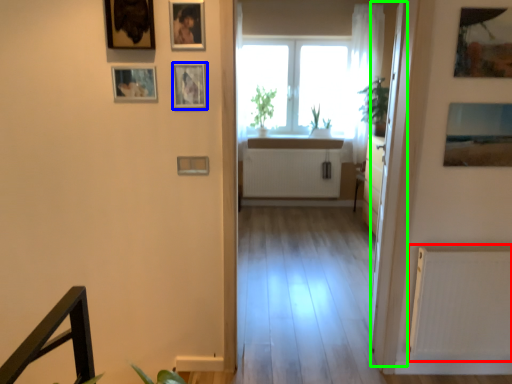
Question: Based on their relative distances, which object is farther from radiator (highlighted by a red box)? Choose from picture frame (highlighted by a blue box) and glass door (highlighted by a green box).

Choices:
 (A) picture frame
 (B) glass door

Answer: (A)